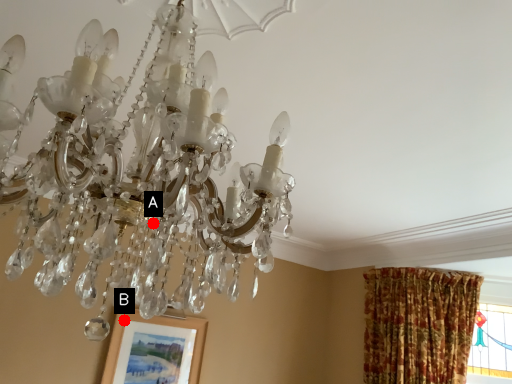
Question: Two points are circled on the image, labeled by A and B beside each circle. Which of the following is the closest to the observer?

Choices:
 (A) A is closer
 (B) B is closer

Answer: (A)